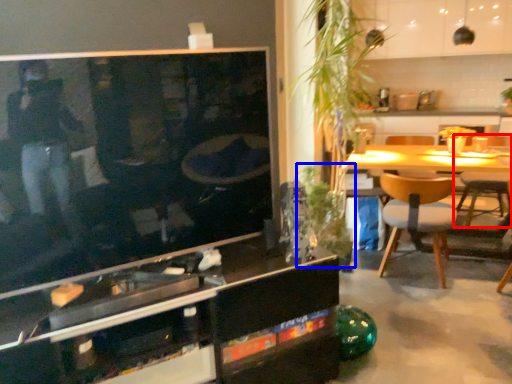
Question: Which of the following is the farthest to the observer, chair (highlighted by a red box) or plant (highlighted by a blue box)?

Choices:
 (A) chair
 (B) plant

Answer: (A)